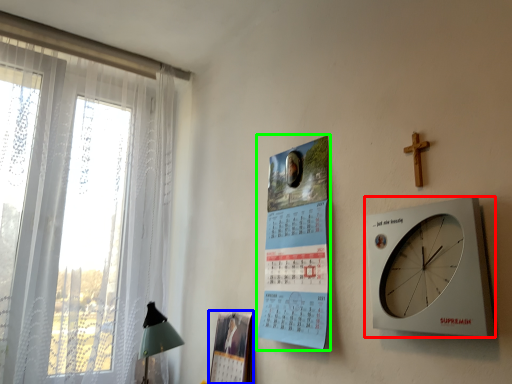
Question: Which object is positioned closest to wall clock (highlighted by a red box)? Select from magazine (highlighted by a blue box) and poster page (highlighted by a green box).

Choices:
 (A) magazine
 (B) poster page

Answer: (B)